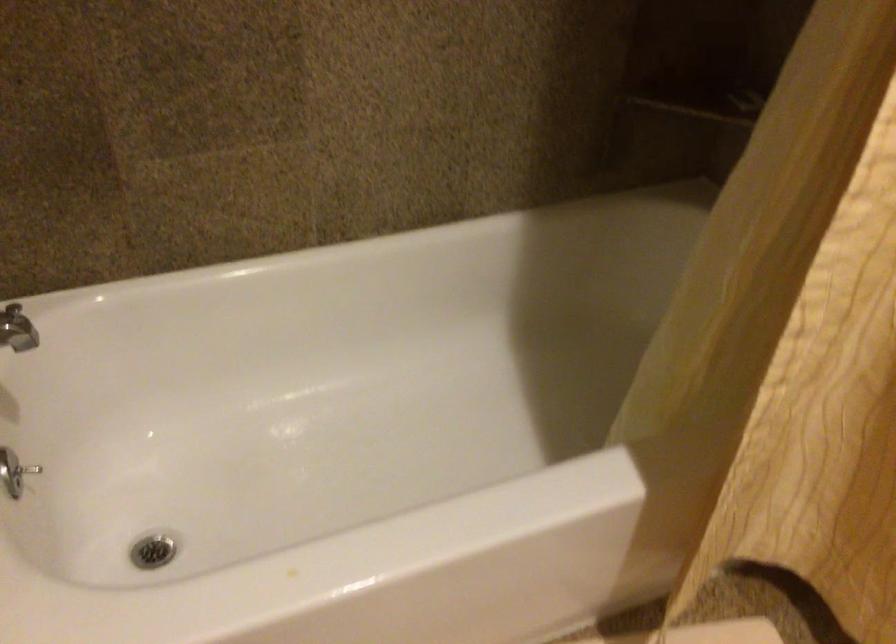
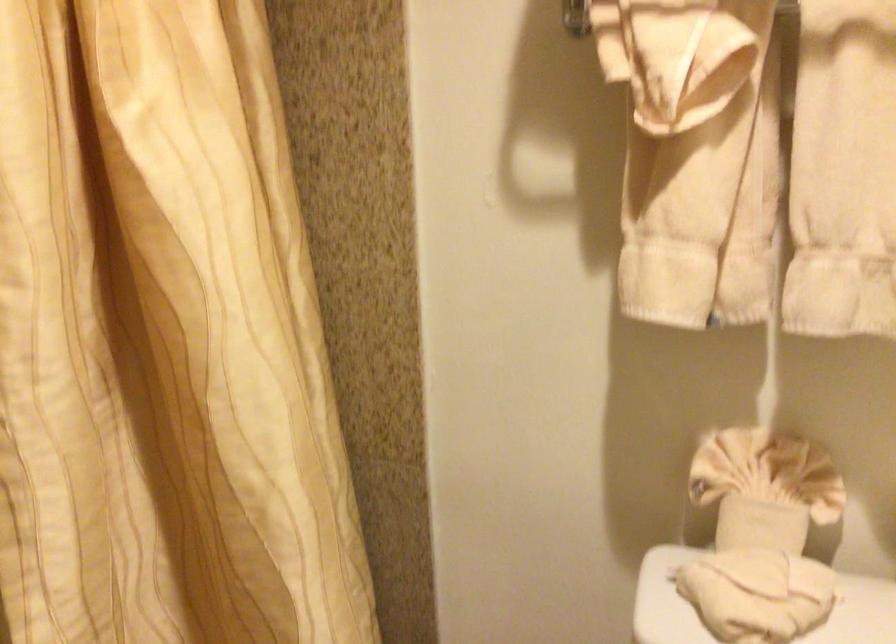
Question: The first image is from the beginning of the video and the second image is from the end. How did the camera likely rotate when shooting the video?

Choices:
 (A) Left
 (B) Right
 (C) Up
 (D) Down

Answer: (B)